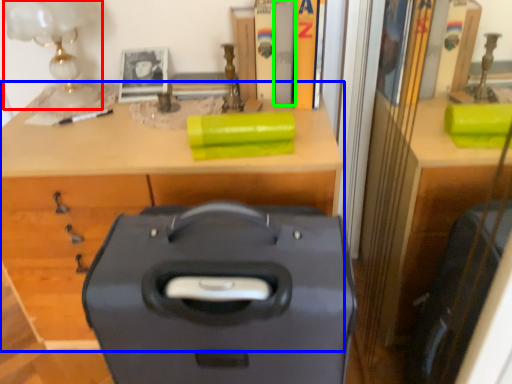
Question: Which object is the closest to the table lamp (highlighted by a red box)? Choose among these: desk (highlighted by a blue box) or book (highlighted by a green box).

Choices:
 (A) desk
 (B) book

Answer: (A)